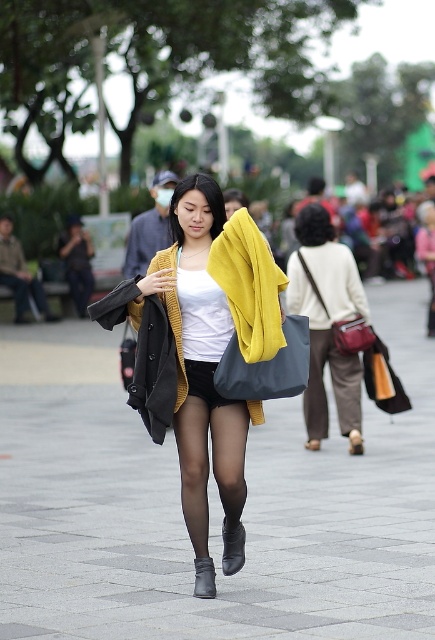
Question: Can you confirm if matte brown bag at center is positioned above brown fabric pants at lower center?

Choices:
 (A) no
 (B) yes

Answer: (B)

Question: Based on their relative distances, which object is farther from the black leather boot at lower center?

Choices:
 (A) matte yellow sweater at center
 (B) brown fabric pants at lower center

Answer: (B)

Question: Which object appears farthest from the camera in this image?

Choices:
 (A) brown fabric pants at lower center
 (B) leather boot at center
 (C) matte brown bag at center
 (D) matte yellow sweater at center

Answer: (A)

Question: Which point appears farthest from the camera in this image?

Choices:
 (A) (355, 426)
 (B) (293, 248)

Answer: (B)

Question: Where is gray concrete pavement at center located in relation to matte yellow sweater at center in the image?

Choices:
 (A) right
 (B) left

Answer: (B)

Question: Is the position of matte brown bag at center less distant than that of black leather boot at lower center?

Choices:
 (A) yes
 (B) no

Answer: (B)